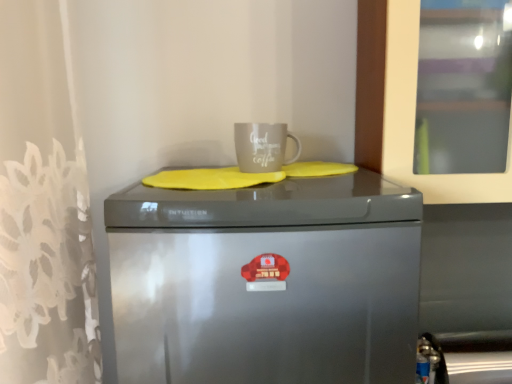
Question: Considering the relative positions of satin silver fridge at center and white glossy mug at upper center in the image provided, is satin silver fridge at center to the right of white glossy mug at upper center from the viewer's perspective?

Choices:
 (A) no
 (B) yes

Answer: (A)

Question: Is satin silver fridge at center thinner than white glossy mug at upper center?

Choices:
 (A) yes
 (B) no

Answer: (B)

Question: From the image's perspective, does satin silver fridge at center appear lower than white glossy mug at upper center?

Choices:
 (A) no
 (B) yes

Answer: (B)

Question: Is satin silver fridge at center turned away from white glossy mug at upper center?

Choices:
 (A) yes
 (B) no

Answer: (B)

Question: From a real-world perspective, is satin silver fridge at center below white glossy mug at upper center?

Choices:
 (A) no
 (B) yes

Answer: (B)

Question: From a real-world perspective, is satin silver fridge at center physically above white glossy mug at upper center?

Choices:
 (A) no
 (B) yes

Answer: (A)

Question: Are white glossy mug at upper center and satin silver fridge at center far apart?

Choices:
 (A) no
 (B) yes

Answer: (A)

Question: From a real-world perspective, is white glossy mug at upper center located higher than satin silver fridge at center?

Choices:
 (A) no
 (B) yes

Answer: (B)

Question: Is white glossy mug at upper center thinner than satin silver fridge at center?

Choices:
 (A) no
 (B) yes

Answer: (B)

Question: Is white glossy mug at upper center shorter than satin silver fridge at center?

Choices:
 (A) yes
 (B) no

Answer: (A)

Question: Does white glossy mug at upper center have a greater height compared to satin silver fridge at center?

Choices:
 (A) no
 (B) yes

Answer: (A)

Question: Can you confirm if white glossy mug at upper center is positioned to the right of satin silver fridge at center?

Choices:
 (A) yes
 (B) no

Answer: (A)

Question: Based on their positions, is satin silver fridge at center located to the left or right of white glossy mug at upper center?

Choices:
 (A) right
 (B) left

Answer: (B)